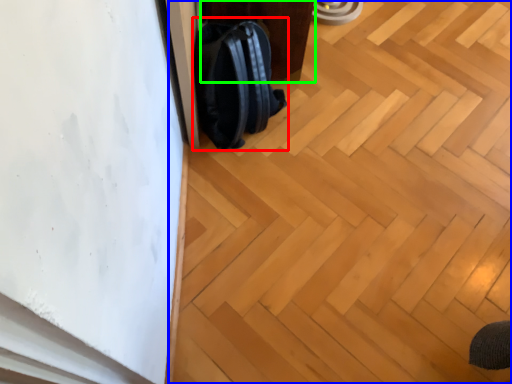
Question: Estimate the real-world distances between objects in this image. Which object is farther from backpack (highlighted by a red box), plywood (highlighted by a blue box) or furniture (highlighted by a green box)?

Choices:
 (A) plywood
 (B) furniture

Answer: (A)